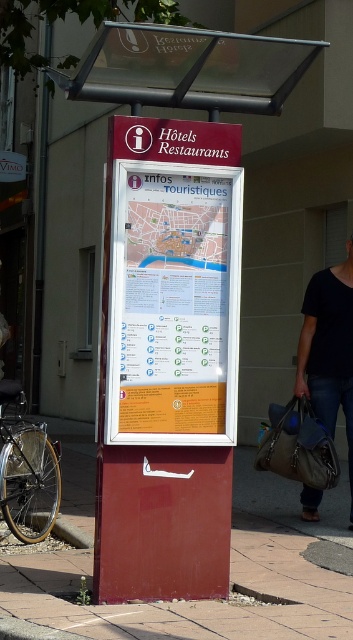
You are a tourist standing in front of the red information kiosk and you see both the black leather bag at lower right and the leather textured bag at lower right. Which bag is closer to you?

The black leather bag at lower right is closer to you because the leather textured bag at lower right is behind it.

You are a tourist standing in front of the red information kiosk. You need to check the city map displayed on the signboard. Which object has a larger width between the matte plastic signboard at center and the smooth concrete pavement at lower center?

The matte plastic signboard at center has a larger width than the smooth concrete pavement at lower center according to the description.